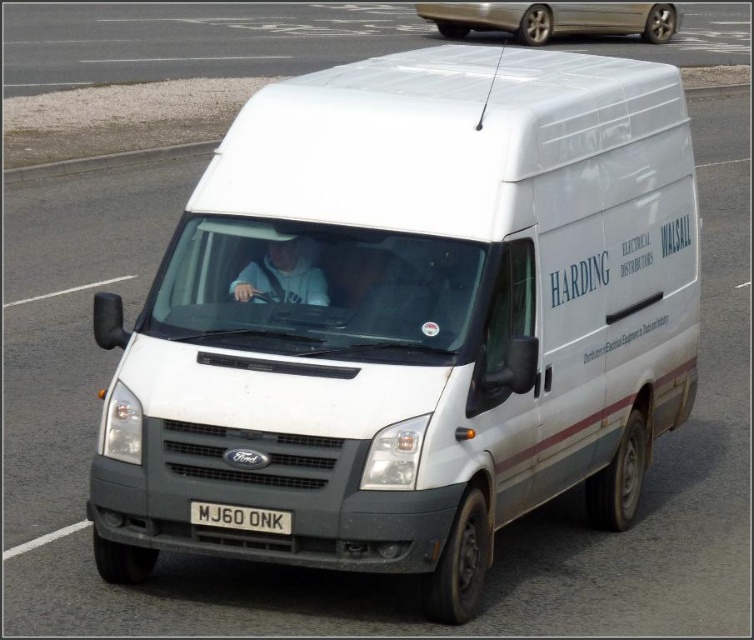
You are a driver approaching the white Ford Transit van and notice a metallic silver sedan at upper center and a white plastic license plate at center. Which object is positioned to the right side of the other?

The metallic silver sedan at upper center is to the right of the white plastic license plate at center.

You are a traffic officer observing a white Ford Transit van on the highway. You notice a metallic silver sedan at upper center and a white plastic license plate at center. Which object is wider?

The metallic silver sedan at upper center is wider than the white plastic license plate at center.